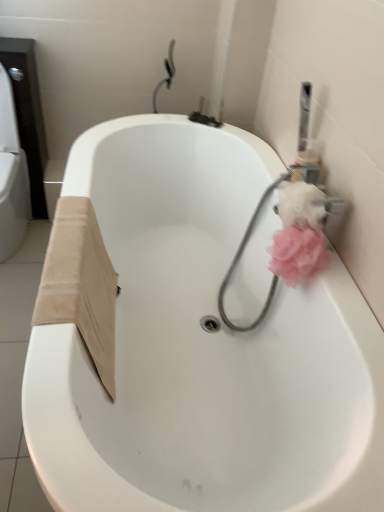
Question: Is white glossy bathtub at center surrounding pink fluffy toilet paper at upper right?

Choices:
 (A) no
 (B) yes

Answer: (A)

Question: From the image's perspective, is white glossy bathtub at center over pink fluffy toilet paper at upper right?

Choices:
 (A) no
 (B) yes

Answer: (A)

Question: Is white glossy bathtub at center facing away from pink fluffy toilet paper at upper right?

Choices:
 (A) no
 (B) yes

Answer: (A)

Question: Would you consider white glossy bathtub at center to be distant from pink fluffy toilet paper at upper right?

Choices:
 (A) yes
 (B) no

Answer: (B)

Question: Considering the relative sizes of white glossy bathtub at center and pink fluffy toilet paper at upper right in the image provided, is white glossy bathtub at center taller than pink fluffy toilet paper at upper right?

Choices:
 (A) no
 (B) yes

Answer: (B)

Question: From the image's perspective, is pink fabric bath puff at right positioned above or below pink fluffy toilet paper at upper right?

Choices:
 (A) below
 (B) above

Answer: (A)

Question: Looking at the image, does pink fabric bath puff at right seem bigger or smaller compared to pink fluffy toilet paper at upper right?

Choices:
 (A) big
 (B) small

Answer: (A)

Question: Relative to pink fluffy toilet paper at upper right, is pink fabric bath puff at right in front or behind?

Choices:
 (A) behind
 (B) front

Answer: (A)

Question: Is pink fabric bath puff at right inside or outside of pink fluffy toilet paper at upper right?

Choices:
 (A) outside
 (B) inside

Answer: (A)

Question: Based on their positions, is pink fluffy toilet paper at upper right located to the left or right of pink fluffy loofah at right?

Choices:
 (A) right
 (B) left

Answer: (A)

Question: Is pink fluffy toilet paper at upper right bigger or smaller than pink fluffy loofah at right?

Choices:
 (A) big
 (B) small

Answer: (B)

Question: Considering the positions of pink fluffy toilet paper at upper right and pink fluffy loofah at right in the image, is pink fluffy toilet paper at upper right wider or thinner than pink fluffy loofah at right?

Choices:
 (A) thin
 (B) wide

Answer: (B)

Question: Is pink fluffy toilet paper at upper right taller or shorter than pink fluffy loofah at right?

Choices:
 (A) tall
 (B) short

Answer: (B)

Question: Is pink fabric bath puff at right inside the boundaries of white glossy bathtub at center, or outside?

Choices:
 (A) outside
 (B) inside

Answer: (B)

Question: From the image's perspective, is pink fabric bath puff at right located above or below white glossy bathtub at center?

Choices:
 (A) below
 (B) above

Answer: (B)